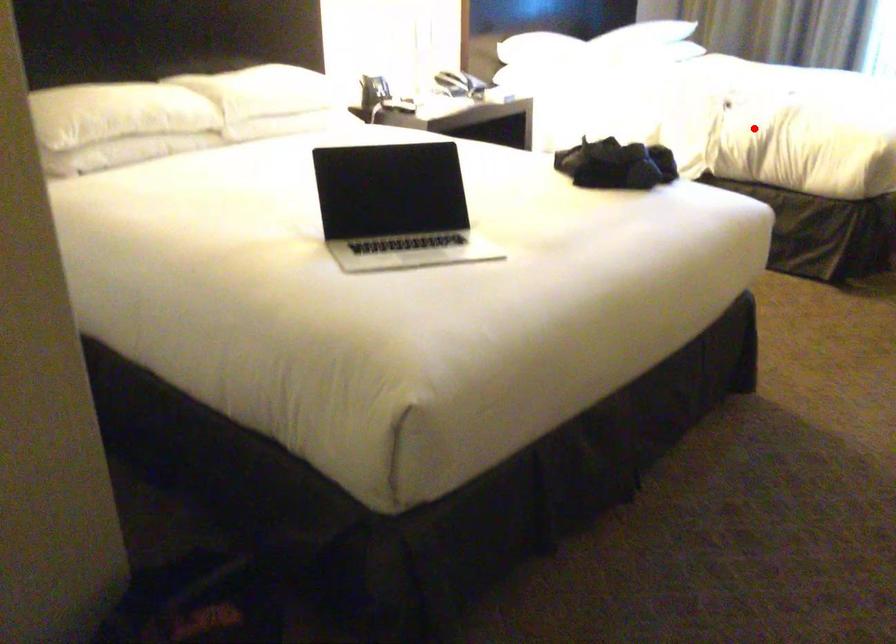
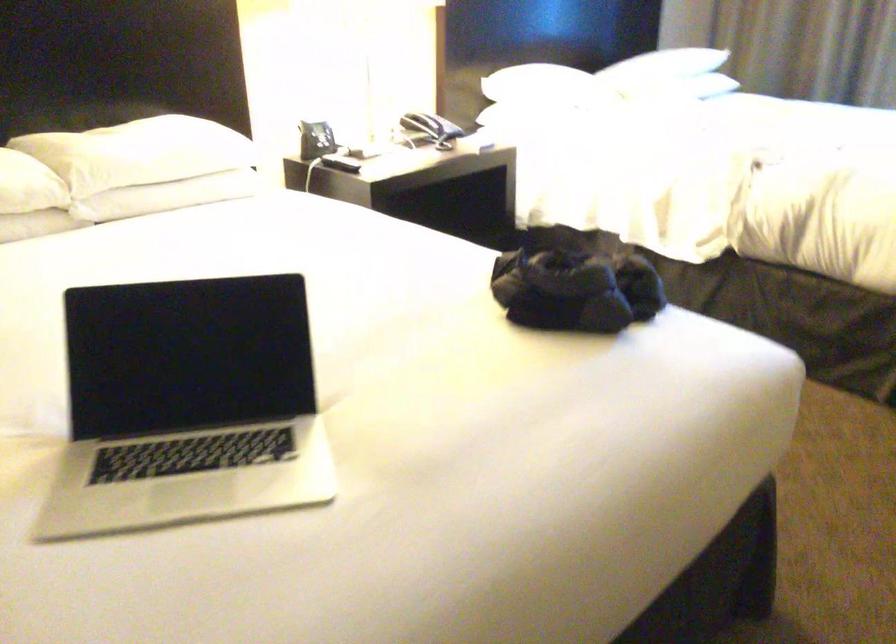
Find the pixel in the second image that matches the highlighted location in the first image.

(784, 212)